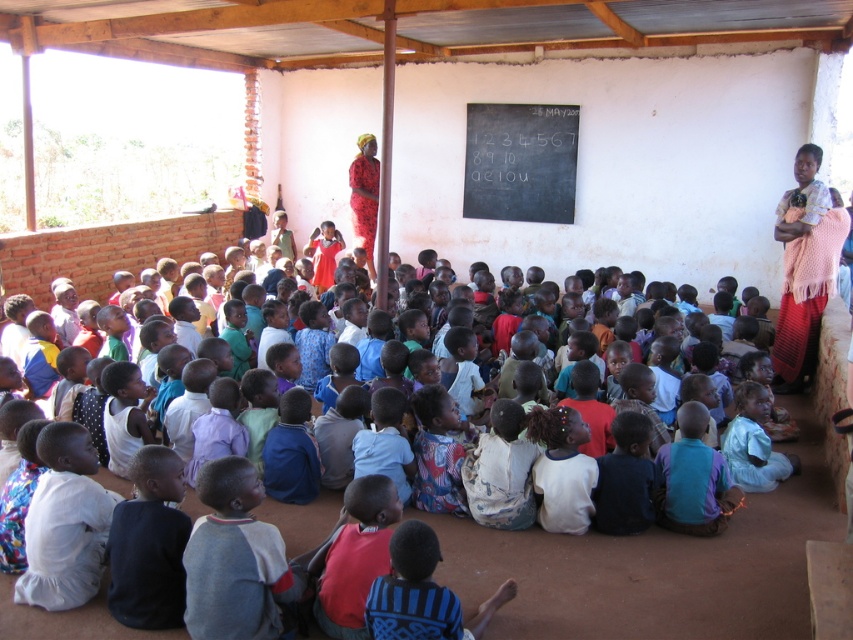
Question: Is light blue shirt at center bigger than pink knitted shawl at upper right?

Choices:
 (A) yes
 (B) no

Answer: (B)

Question: Which point appears closest to the camera in this image?

Choices:
 (A) (525, 112)
 (B) (821, 202)
 (C) (515, 552)

Answer: (C)

Question: Does black chalkboard at center have a smaller size compared to pink knitted shawl at upper right?

Choices:
 (A) yes
 (B) no

Answer: (B)

Question: Which object is closer to the camera taking this photo?

Choices:
 (A) pink knitted shawl at upper right
 (B) light blue shirt at center
 (C) black chalkboard at center

Answer: (B)

Question: Which object appears closest to the camera in this image?

Choices:
 (A) light blue shirt at center
 (B) black chalkboard at center
 (C) pink knitted shawl at upper right
 (D) red fabric dress at upper center

Answer: (A)

Question: Does pink knitted shawl at upper right have a lesser width compared to red fabric dress at upper center?

Choices:
 (A) no
 (B) yes

Answer: (A)